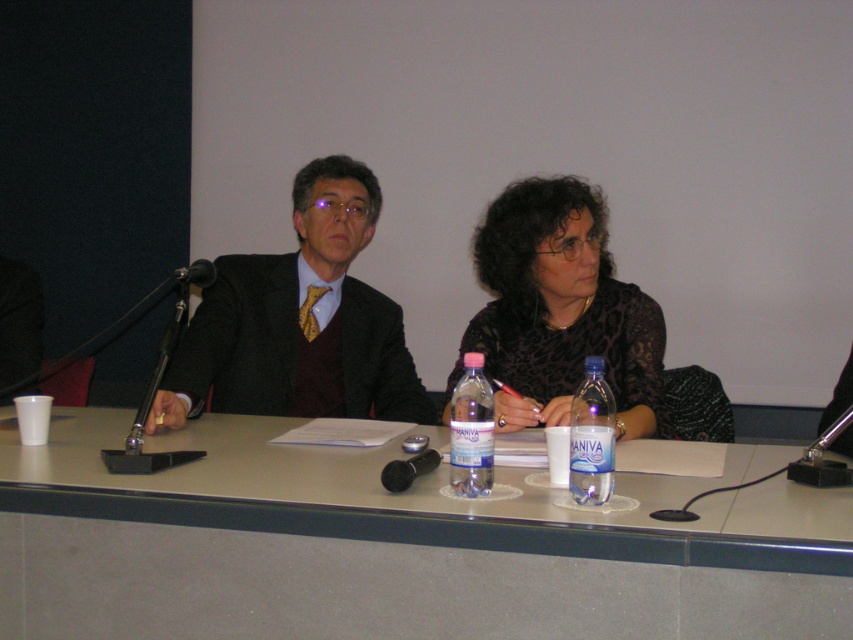
You are a photographer at a formal event. You need to capture a photo where the black lace shirt at center and the transparent plastic bottle at center are both visible. Based on their positions, which object should you ensure is in the foreground to include both in the frame?

The black lace shirt at center is above the transparent plastic bottle at center, so to include both in the frame, ensure the black lace shirt at center is in the foreground.

You are a photographer positioned behind the table. You need to adjust the camera angle so that both the dark gray wool suit at left and the black metallic microphone at left are fully visible in the frame. Based on their heights, which object should be placed closer to the camera to ensure both are visible without cropping?

The dark gray wool suit at left has a greater height compared to the black metallic microphone at left, so to ensure both are fully visible in the frame, the dark gray wool suit at left should be placed closer to the camera. This way, the taller object will occupy more vertical space, allowing the shorter microphone to still be captured without cropping.

What is located at the coordinates point (561,308)?

The black lace shirt at center is located at point (561,308).